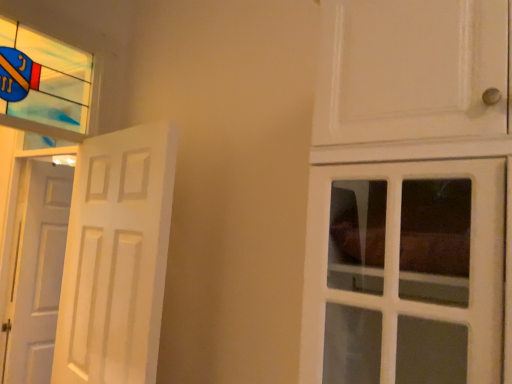
Image resolution: width=512 pixels, height=384 pixels. What are the coordinates of `white matte door at left, the second door viewed from the front` in the screenshot? It's located at tap(36, 271).

What do you see at coordinates (48, 86) in the screenshot? This screenshot has height=384, width=512. I see `stained glass window at upper left` at bounding box center [48, 86].

Describe the element at coordinates (116, 257) in the screenshot. I see `white matte door at left, the 2th door positioned from the back` at that location.

This screenshot has width=512, height=384. I want to click on white matte door at left, arranged as the 1th door when viewed from the left, so click(x=36, y=271).

Which object is thinner, white matte door at left, the 1th door in the right-to-left sequence, or stained glass window at upper left?

stained glass window at upper left is thinner.

Visually, is white matte door at left, placed as the second door when sorted from left to right, positioned to the left or to the right of stained glass window at upper left?

In the image, white matte door at left, placed as the second door when sorted from left to right, appears on the right side of stained glass window at upper left.

From the image's perspective, is white matte door at left, which is counted as the 1th door, starting from the front, on stained glass window at upper left?

Incorrect, from the image's perspective, white matte door at left, which is counted as the 1th door, starting from the front, is lower than stained glass window at upper left.

Does point (113, 157) come closer to viewer compared to point (87, 90)?

Yes, it is.

Which is more to the left, white matte door at left, placed as the second door when sorted from left to right, or white matte door at left, the second door positioned from the right?

Positioned to the left is white matte door at left, the second door positioned from the right.

Is white matte door at left, which is counted as the 1th door, starting from the front, thinner than white matte door at left, arranged as the 1th door when viewed from the left?

No.

From the picture: Is white matte door at left, which is counted as the 1th door, starting from the front, bigger or smaller than white matte door at left, arranged as the 1th door when viewed from the left?

Clearly, white matte door at left, which is counted as the 1th door, starting from the front, is larger in size than white matte door at left, arranged as the 1th door when viewed from the left.

Is stained glass window at upper left bigger than white matte door at left, arranged as the 1th door when viewed from the back?

Actually, stained glass window at upper left might be smaller than white matte door at left, arranged as the 1th door when viewed from the back.

Are stained glass window at upper left and white matte door at left, arranged as the 1th door when viewed from the left, beside each other?

No, stained glass window at upper left is not beside white matte door at left, arranged as the 1th door when viewed from the left.

Is white matte door at left, the second door positioned from the right, at the back of stained glass window at upper left?

No, stained glass window at upper left is not facing away from white matte door at left, the second door positioned from the right.

In the scene shown: Considering the relative positions of stained glass window at upper left and white matte door at left, the second door viewed from the front, in the image provided, is stained glass window at upper left to the right of white matte door at left, the second door viewed from the front, from the viewer's perspective?

Correct, you'll find stained glass window at upper left to the right of white matte door at left, the second door viewed from the front.

Can we say white matte door at left, the second door positioned from the right, lies outside stained glass window at upper left?

Absolutely, white matte door at left, the second door positioned from the right, is external to stained glass window at upper left.

From a real-world perspective, who is located higher, white matte door at left, arranged as the 1th door when viewed from the back, or stained glass window at upper left?

From a 3D spatial view, stained glass window at upper left is above.

Is point (11, 346) closer to camera compared to point (2, 41)?

No, it is not.

Does white matte door at left, the second door viewed from the front, have a larger size compared to stained glass window at upper left?

Correct, white matte door at left, the second door viewed from the front, is larger in size than stained glass window at upper left.

Is stained glass window at upper left far away from white matte door at left, which is counted as the 1th door, starting from the front?

No, stained glass window at upper left is not far away from white matte door at left, which is counted as the 1th door, starting from the front.

Is stained glass window at upper left to the left of white matte door at left, the 2th door positioned from the back, from the viewer's perspective?

Yes, stained glass window at upper left is to the left of white matte door at left, the 2th door positioned from the back.

Locate an element on the screen. Image resolution: width=512 pixels, height=384 pixels. door to the right of white matte door at left, the second door positioned from the right is located at coordinates (116, 257).

From a real-world perspective, which object stands above the other?

In real-world perspective, white matte door at left, which is counted as the 1th door, starting from the front, is above.

Choose the correct answer: Is white matte door at left, the second door viewed from the front, inside white matte door at left, which is counted as the 1th door, starting from the front, or outside it?

The correct answer is: outside.

Is white matte door at left, arranged as the 1th door when viewed from the left, oriented towards white matte door at left, the 2th door positioned from the back?

No, white matte door at left, arranged as the 1th door when viewed from the left, is not aimed at white matte door at left, the 2th door positioned from the back.

Image resolution: width=512 pixels, height=384 pixels. What are the coordinates of `window located on the left of white matte door at left, the 1th door in the right-to-left sequence` in the screenshot? It's located at (48, 86).

Image resolution: width=512 pixels, height=384 pixels. I want to click on door that is on the right side of white matte door at left, the second door viewed from the front, so click(116, 257).

Considering their positions, is white matte door at left, arranged as the 1th door when viewed from the back, positioned further to stained glass window at upper left than white matte door at left, the 2th door positioned from the back?

white matte door at left, arranged as the 1th door when viewed from the back, is further to stained glass window at upper left.

When comparing their distances from stained glass window at upper left, does white matte door at left, the 1th door in the right-to-left sequence, or white matte door at left, the second door viewed from the front, seem further?

white matte door at left, the second door viewed from the front, is positioned further to the anchor stained glass window at upper left.

Based on their spatial positions, is stained glass window at upper left or white matte door at left, the 2th door positioned from the back, further from white matte door at left, the second door viewed from the front?

white matte door at left, the 2th door positioned from the back, is positioned further to the anchor white matte door at left, the second door viewed from the front.

Looking at the image, which one is located further to white matte door at left, the 2th door positioned from the back, stained glass window at upper left or white matte door at left, arranged as the 1th door when viewed from the back?

The object further to white matte door at left, the 2th door positioned from the back, is white matte door at left, arranged as the 1th door when viewed from the back.

Estimate the real-world distances between objects in this image. Which object is further from white matte door at left, the 1th door in the right-to-left sequence, white matte door at left, arranged as the 1th door when viewed from the back, or stained glass window at upper left?

white matte door at left, arranged as the 1th door when viewed from the back.

Looking at the image, which one is located closer to white matte door at left, the second door positioned from the right, white matte door at left, which is counted as the 1th door, starting from the front, or stained glass window at upper left?

The object closer to white matte door at left, the second door positioned from the right, is stained glass window at upper left.

Find the location of a particular element. The width and height of the screenshot is (512, 384). window between white matte door at left, the 1th door in the right-to-left sequence, and white matte door at left, the second door positioned from the right, from front to back is located at coordinates click(x=48, y=86).